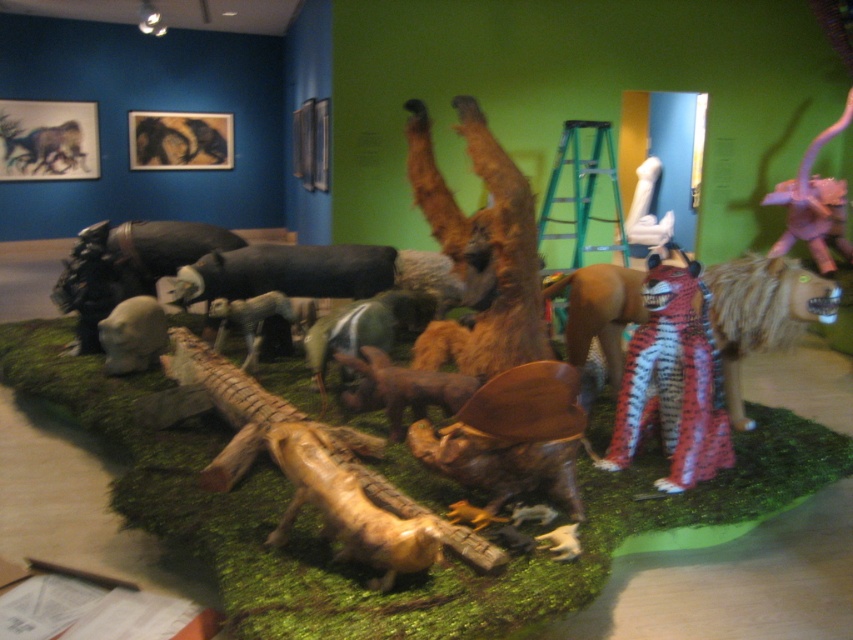
You are standing in the gallery and want to take a closer look at the purple matte dinosaur at upper right. If you walk 10 feet towards it, how far will you be from the dinosaur?

The purple matte dinosaur at upper right is initially 19.17 feet away. After walking 10 feet closer, you would be 9.17 feet away from it.